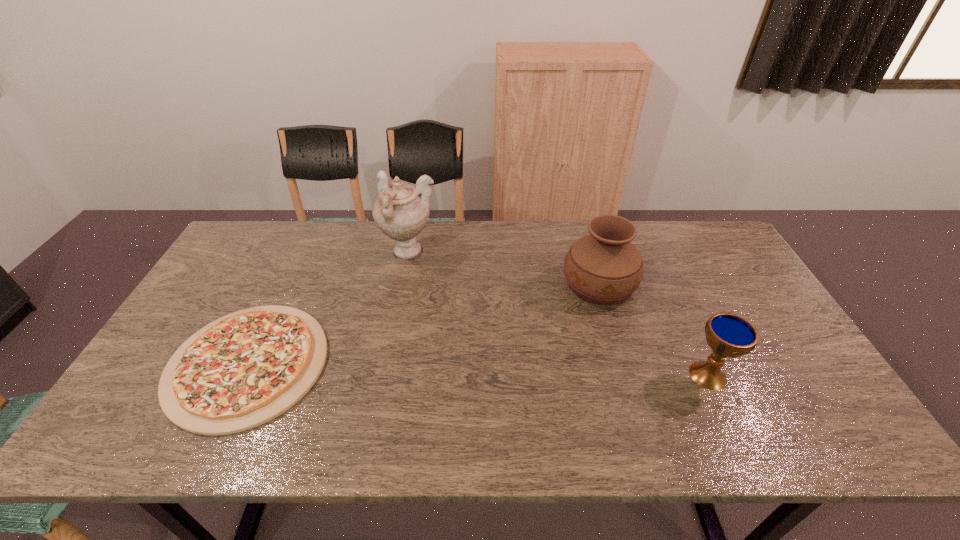
This screenshot has width=960, height=540. In order to click on vacant space situated on the back of the rightmost object in this screenshot , I will do `click(680, 313)`.

Locate an element on the screen. vacant region located on the right of the leftmost object is located at coordinates (402, 364).

The image size is (960, 540). What are the coordinates of `object that is at the near edge` in the screenshot? It's located at (244, 369).

Locate an element on the screen. The width and height of the screenshot is (960, 540). object present at the left edge is located at coordinates (244, 369).

This screenshot has height=540, width=960. I want to click on object that is at the near left corner, so click(244, 369).

Locate an element on the screen. This screenshot has width=960, height=540. blank space at the far edge of the desktop is located at coordinates (537, 222).

This screenshot has height=540, width=960. What are the coordinates of `vacant region at the near edge` in the screenshot? It's located at (714, 418).

At what (x,y) coordinates should I click in order to perform the action: click on vacant space at the left edge of the desktop. Please return your answer as a coordinate pair (x, y). The image size is (960, 540). Looking at the image, I should click on (206, 284).

This screenshot has height=540, width=960. Identify the location of free region at the right edge of the desktop. (733, 296).

In the image, there is a desktop. Where is `vacant space at the far right corner`? vacant space at the far right corner is located at coordinates (684, 227).